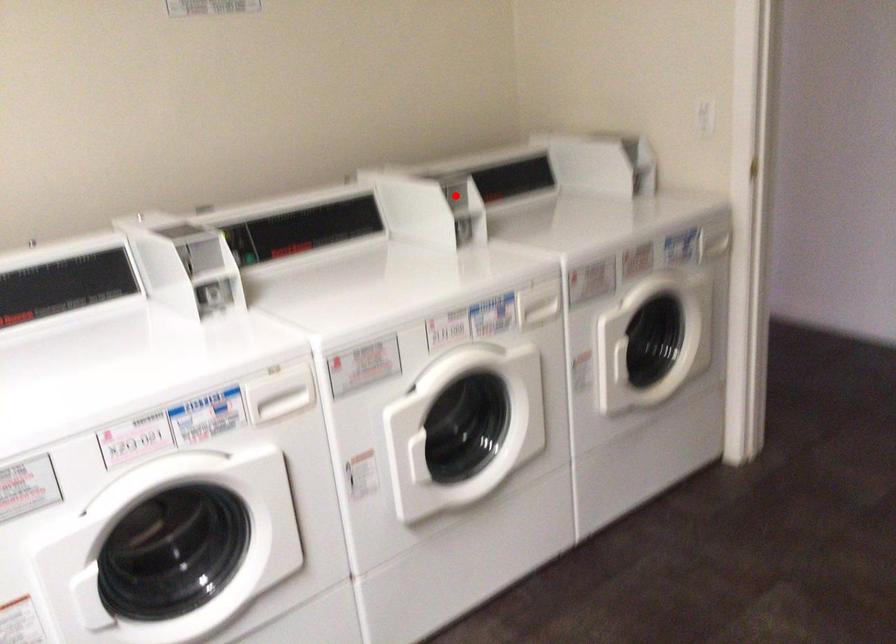
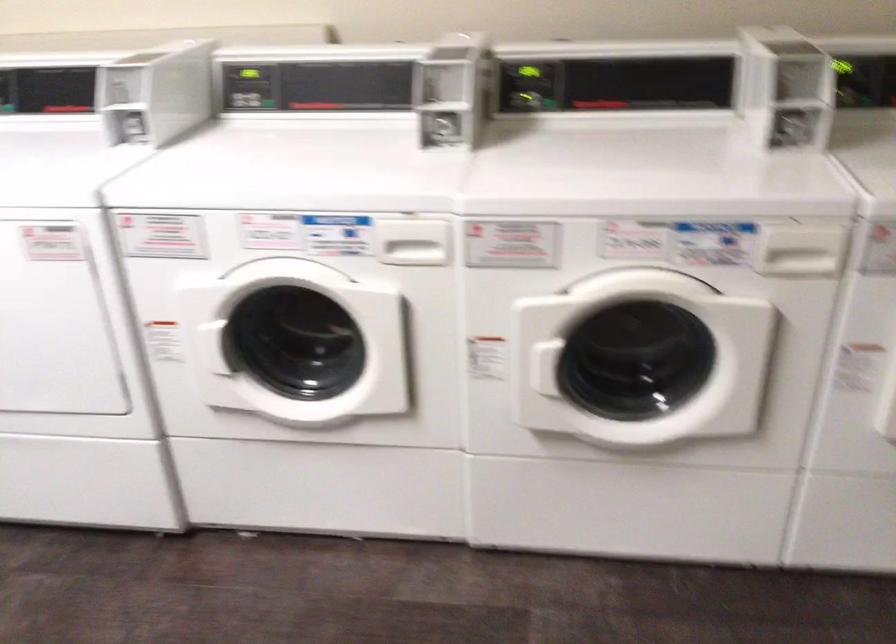
Find the pixel in the second image that matches the highlighted location in the first image.

(794, 80)